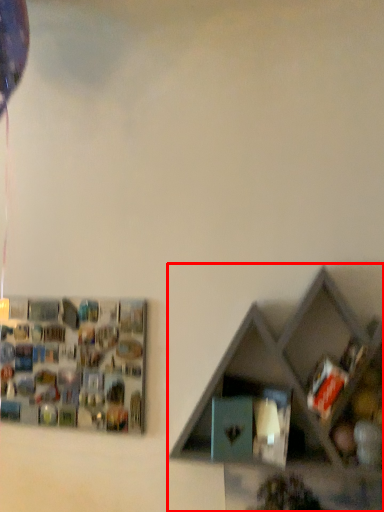
Question: Considering the relative positions of shelf (annotated by the red box) and shelf in the image provided, where is shelf (annotated by the red box) located with respect to the staircase?

Choices:
 (A) left
 (B) right

Answer: (B)